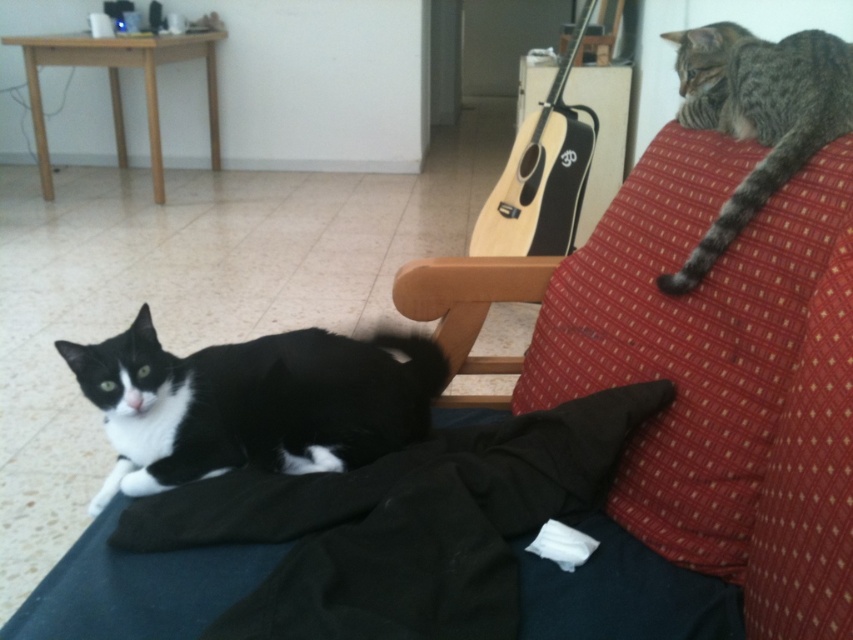
You are a photographer setting up for a pet photoshoot. You have a camera that can only focus on objects wider than 30 cm. You see the tabby fur cat at upper right and the light wood acoustic guitar at upper center in the frame. Can both subjects fit within the camera focus range?

The tabby fur cat at upper right is narrower than the light wood acoustic guitar at upper center. Since the camera requires objects wider than 30 cm, we need to know their exact widths. However, the description only states their relative sizes, not specific measurements. Therefore, it is uncertain if both meet the 30 cm requirement without additional information.

You are a cat owner who wants to place a new toy on the red textured pillow at upper right. If your toy is 1 meter long, will it fit on the pillow?

The red textured pillow at upper right is 92.52 centimeters in length. Since the toy is 1 meter long, which is longer than the pillow, it won not fit.